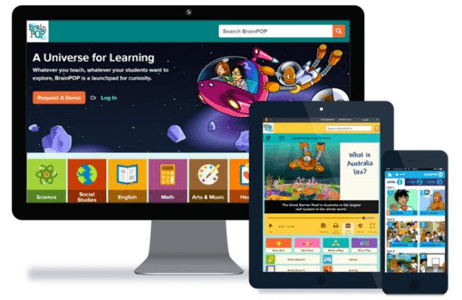
You are a GUI agent. You are given a task and a screenshot of the screen. Output one action in this format:
    pyautogui.click(x=<x>, y=<y>)
    Task: Click on the monitor stand
    
    Given the screenshot: What is the action you would take?
    pyautogui.click(x=194, y=249)